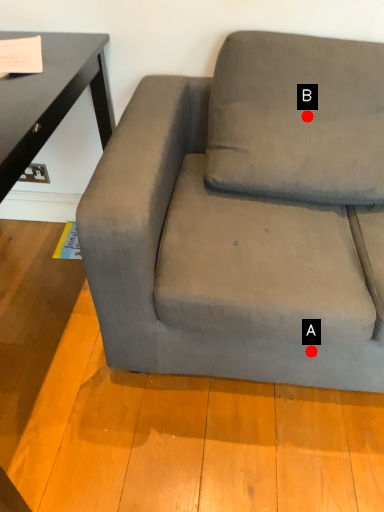
Question: Two points are circled on the image, labeled by A and B beside each circle. Which point is further to the camera?

Choices:
 (A) A is further
 (B) B is further

Answer: (B)